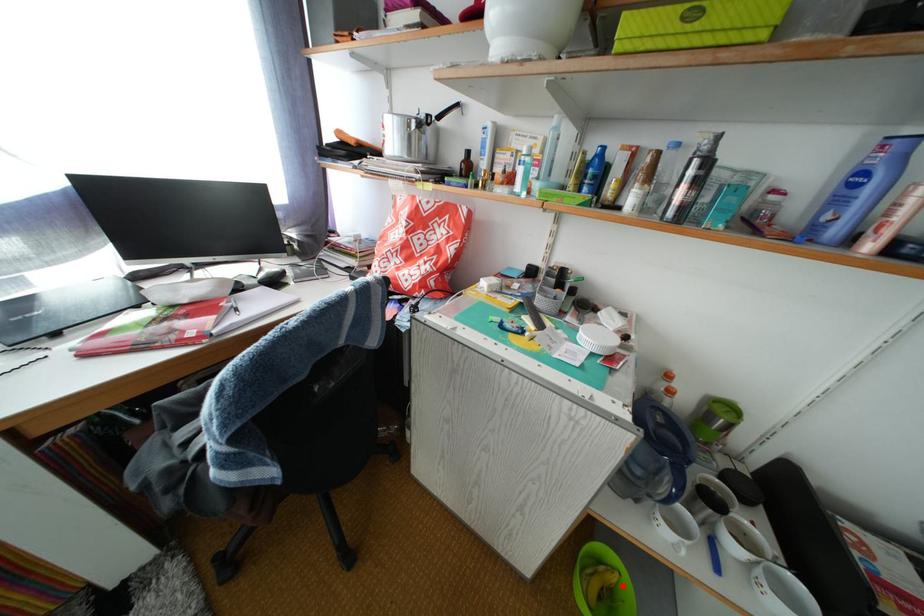
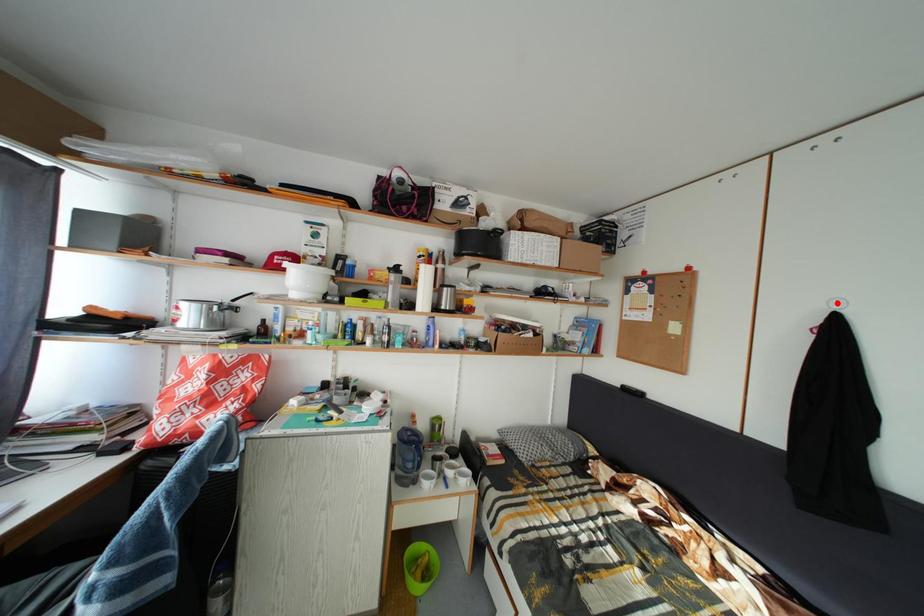
I am providing you with two images of the same scene from different viewpoints. A red point is marked on the first image and another point is marked on the second image. Is the red point in image1 aligned with the point shown in image2?

No